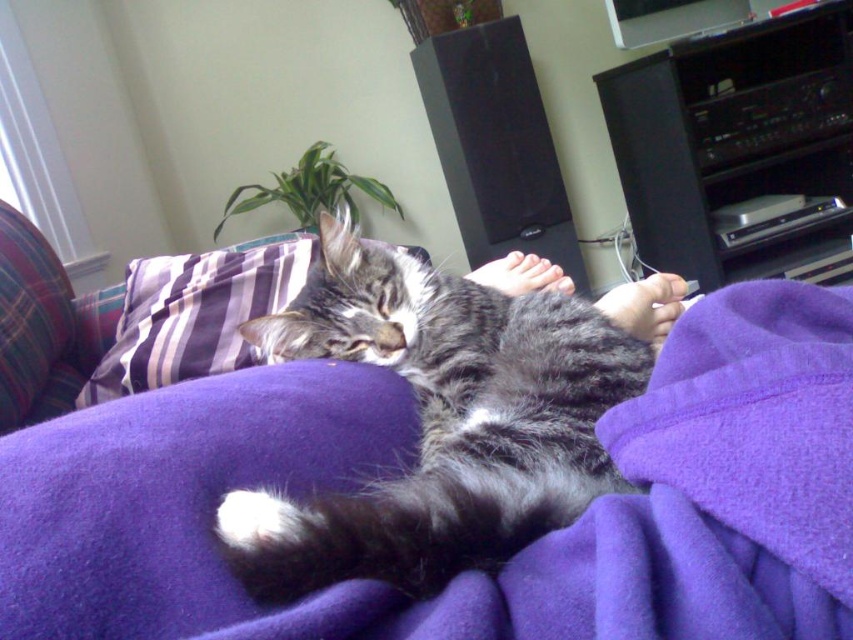
You are a pet sitter observing the scene. You need to determine if the gray tabby cat at center can comfortably rest on the purple striped pillow at upper left based on their sizes. Can it fit?

The gray tabby cat at center has a larger size compared to the purple striped pillow at upper left. Therefore, the cat may not fit comfortably on the pillow due to its larger size.

You are a photographer trying to capture the gray tabby cat at center and the purple striped pillow at upper left in the same frame. Based on their positions, which object is closer to the right side of the photo?

The gray tabby cat at center is closer to the right side of the photo because it is positioned to the right of the purple striped pillow at upper left.

Looking at this image, you are a photographer trying to capture the purple fleece blanket at center and the purple striped pillow at upper left in the same frame. Since both objects are purple, how can you distinguish them in the photo?

The purple fleece blanket at center is positioned on the right side of the purple striped pillow at upper left, so you can distinguish them by their different positions in the frame.